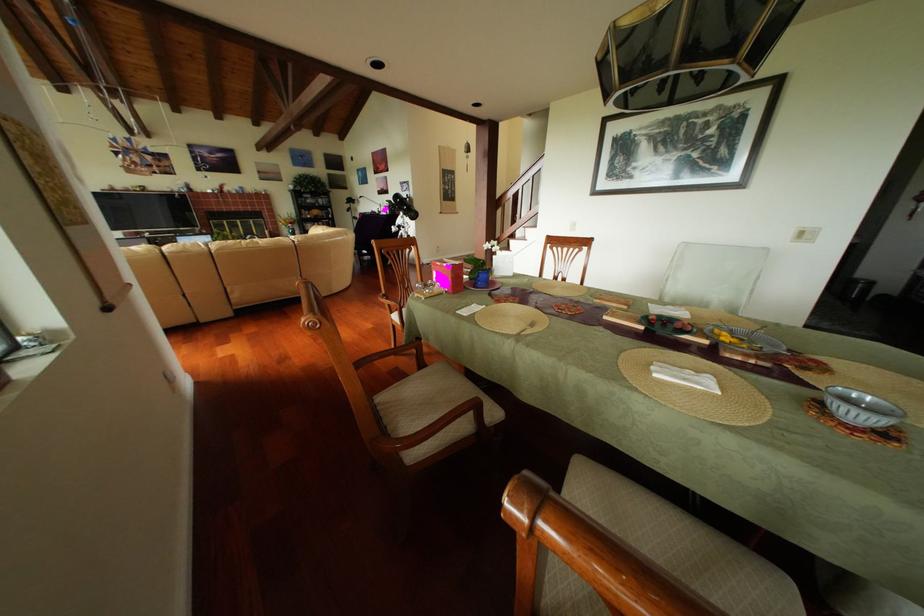
This screenshot has height=616, width=924. What do you see at coordinates (860, 408) in the screenshot? I see `the grey patterned bowl` at bounding box center [860, 408].